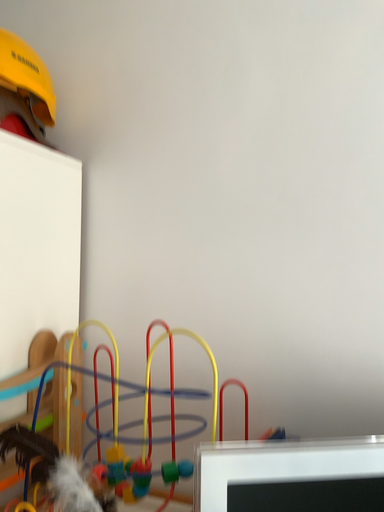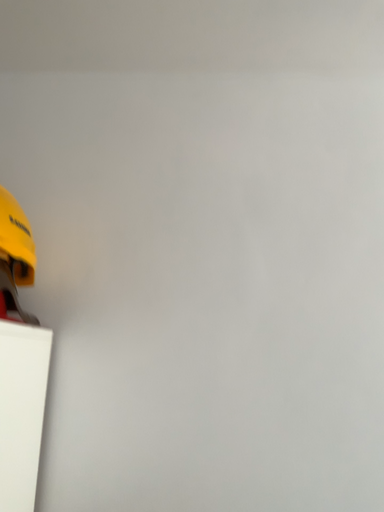
Question: Which way did the camera rotate in the video?

Choices:
 (A) rotated upward
 (B) rotated downward

Answer: (A)